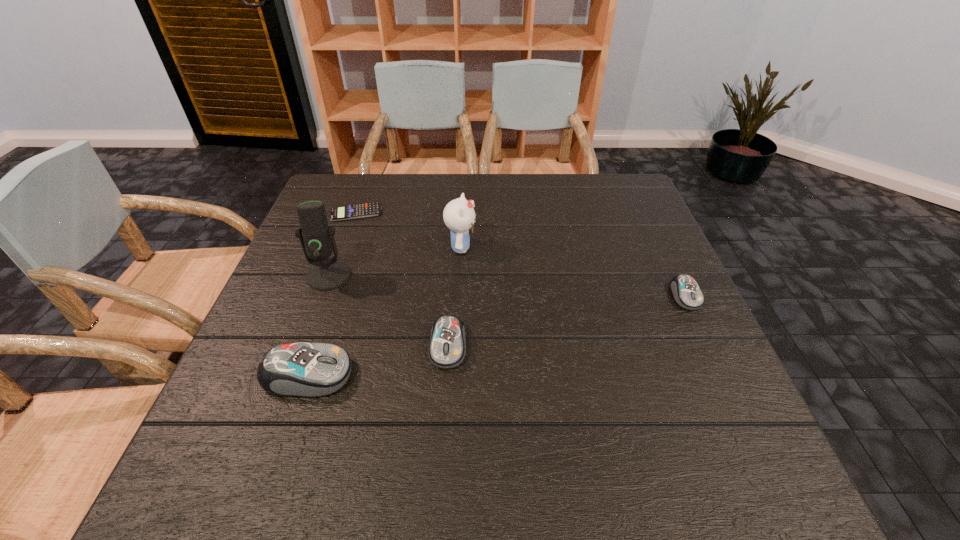
Image resolution: width=960 pixels, height=540 pixels. Identify the location of unoccupied position between the shortest computer mouse and the kitten. (573, 272).

This screenshot has height=540, width=960. I want to click on vacant area between the farthest computer mouse and the microphone, so click(x=507, y=286).

Where is `free spot between the farthest object and the second farthest object`? Image resolution: width=960 pixels, height=540 pixels. free spot between the farthest object and the second farthest object is located at coordinates (409, 230).

Locate an element on the screen. free space between the second shortest computer mouse and the tallest object is located at coordinates (388, 310).

Where is `empty space between the fifth shortest object and the calculator`? The height and width of the screenshot is (540, 960). empty space between the fifth shortest object and the calculator is located at coordinates point(409,230).

This screenshot has width=960, height=540. What are the coordinates of `free space between the fourth tallest object and the tallest object` in the screenshot? It's located at point(388,310).

Where is `free point between the second computer mouse from right to left and the second tallest object`? This screenshot has height=540, width=960. free point between the second computer mouse from right to left and the second tallest object is located at coordinates (455, 296).

The image size is (960, 540). Find the location of `free space between the kitten and the fourth shortest object`. free space between the kitten and the fourth shortest object is located at coordinates (384, 311).

Image resolution: width=960 pixels, height=540 pixels. Identify the location of empty space that is in between the second tallest object and the leftmost computer mouse. tap(384, 311).

Where is `empty location between the tallest computer mouse and the farthest object`? Image resolution: width=960 pixels, height=540 pixels. empty location between the tallest computer mouse and the farthest object is located at coordinates (x=331, y=294).